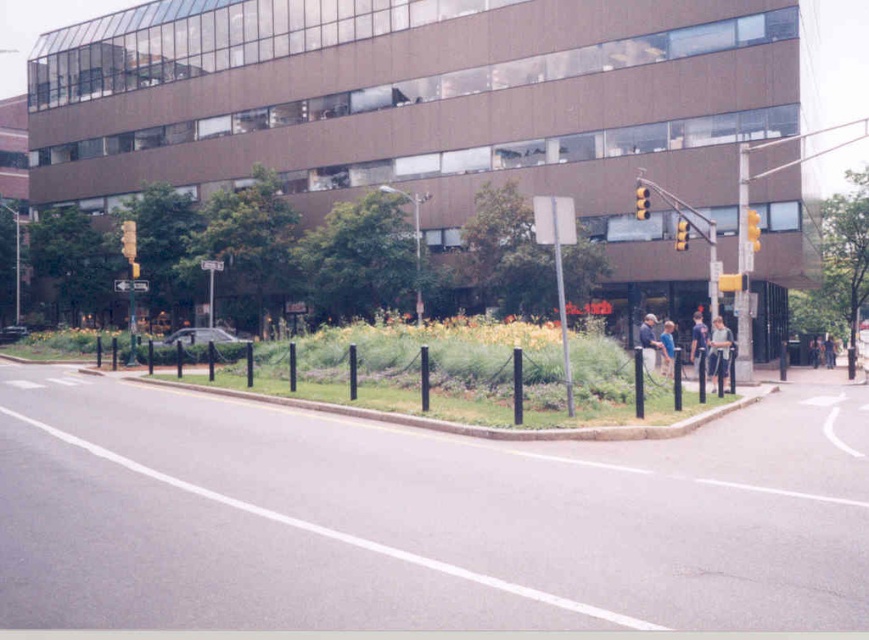
You are standing at the street corner near the modern building with a gray fabric jacket at lower right. You want to take a photo of the building but need to ensure you are far enough away to capture the entire structure. The recommended distance for capturing the building in full is 20 meters. Can you determine if your current position allows you to capture the entire building in your photo?

The gray fabric jacket at lower right is 22.32 meters away from the camera, which means you are currently 22.32 meters away from that jacket. Since the recommended distance is 20 meters, you are already beyond the required distance and should be able to capture the entire building in your photo.

You are standing at the point closest to the building in the urban street corner scene. You want to walk towards the building entrance. There are two points marked on the ground ahead of you, point A at coordinates point A is point (x=638, y=330) and point B is point (x=645, y=192). Which point should you step on first to reach the building entrance?

You should step on point B first because point A is behind point B. Since you are facing the building, point B is closer to you and stepping on it first will help you move towards the entrance more directly.

You are a delivery person standing on the street corner near the building. You need to place a package that is 1.2 meters wide between the gray fabric jacket at lower right and the dark blue jeans at center. Can the package fit between them?

The gray fabric jacket at lower right has a lesser width compared to dark blue jeans at center. Since the package is 1.2 meters wide, and the space between them is narrower than the jeans but wider than the jacket, it is uncertain if it will fit without more specific measurements.